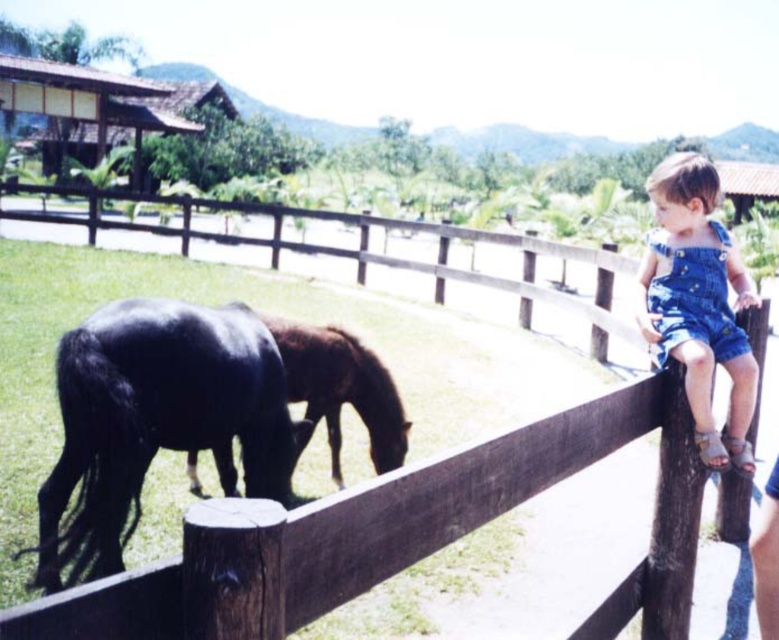
Question: Which of the following is the farthest from the observer?

Choices:
 (A) shiny black horse at lower left
 (B) shiny brown horse at center
 (C) denim overalls at upper right

Answer: (B)

Question: Which of these objects is positioned farthest from the shiny black horse at lower left?

Choices:
 (A) denim overalls at upper right
 (B) brown wooden fence at upper center
 (C) shiny brown horse at center

Answer: (A)

Question: Among these points, which one is nearest to the camera?

Choices:
 (A) (62, 368)
 (B) (732, 394)
 (C) (302, 435)

Answer: (A)

Question: Does brown wooden fence at upper center have a lesser width compared to denim overalls at upper right?

Choices:
 (A) no
 (B) yes

Answer: (A)

Question: Does brown wooden fence at upper center appear under denim overalls at upper right?

Choices:
 (A) no
 (B) yes

Answer: (A)

Question: In this image, where is brown wooden fence at upper center located relative to denim overalls at upper right?

Choices:
 (A) right
 (B) left

Answer: (B)